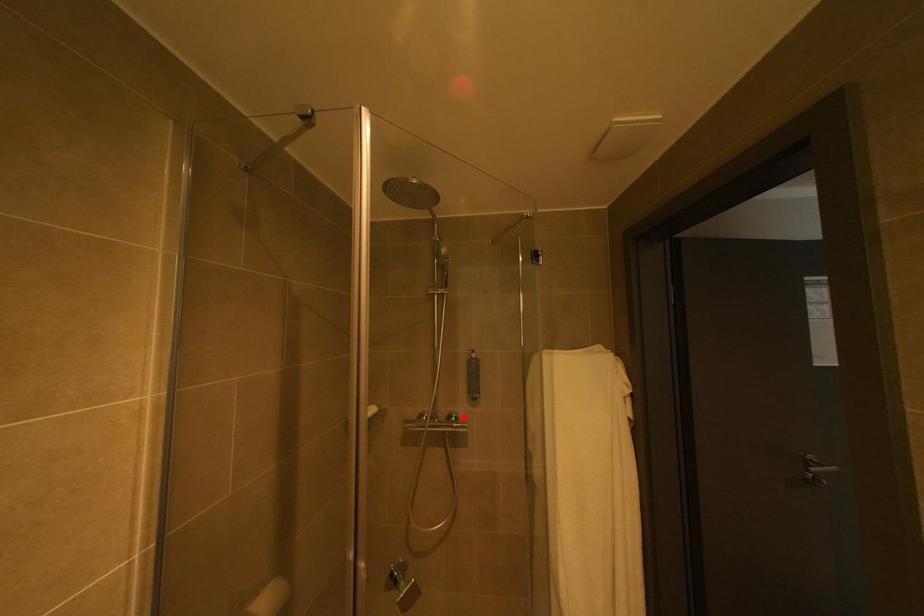
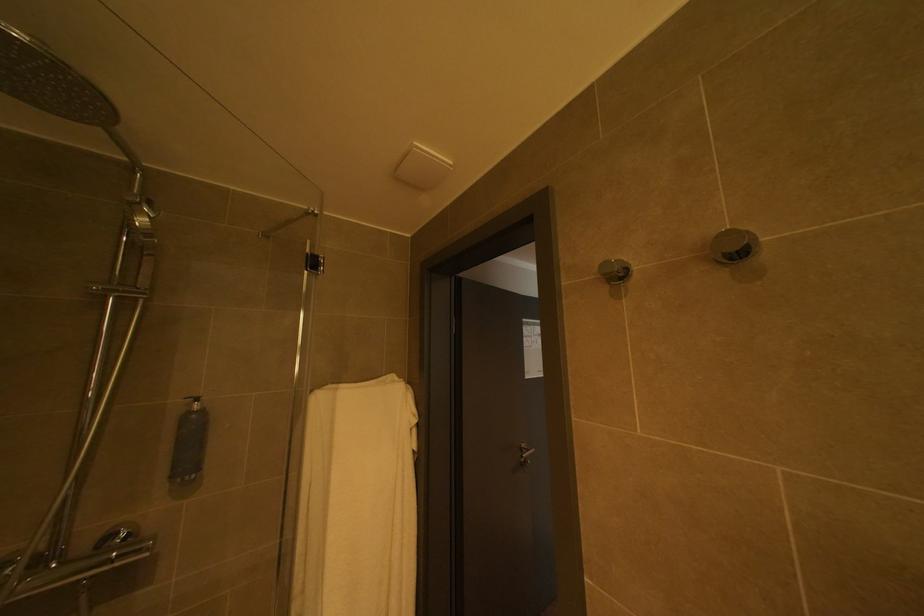
Locate, in the second image, the point that corresponds to the highlighted location in the first image.

(128, 535)